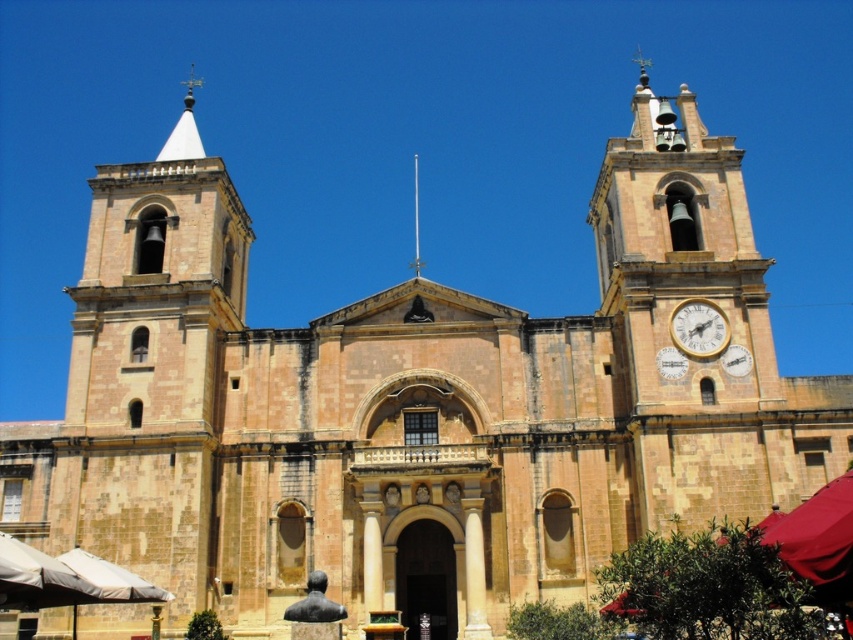
You are an architect planning to install a new decorative element on the church facade. You have two options from the image available for placement. The gold metallic clock at right and the metallic spire at center. If you want to choose the one that takes up more space on the facade, which should you select?

The metallic spire at center occupies more space than the gold metallic clock at right, so you should select the metallic spire at center.

You are standing in front of the church and notice a point at coordinates (699, 328). Which object does this point correspond to?

The point at coordinates (699, 328) corresponds to the gold metallic clock at right.